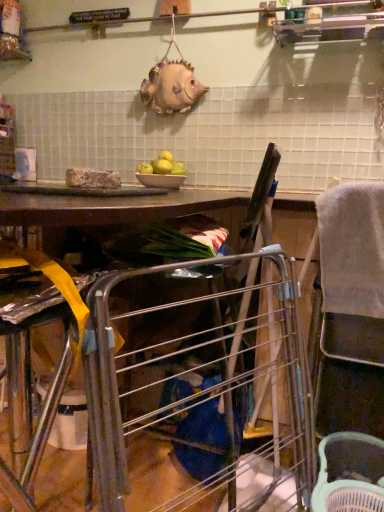
Question: Is white plastic basket at lower right thinner than gray fabric feeding chair at right?

Choices:
 (A) no
 (B) yes

Answer: (A)

Question: Does white plastic basket at lower right have a lesser height compared to gray fabric feeding chair at right?

Choices:
 (A) no
 (B) yes

Answer: (B)

Question: Is white plastic basket at lower right not within gray fabric feeding chair at right?

Choices:
 (A) yes
 (B) no

Answer: (A)

Question: Is white plastic basket at lower right in contact with gray fabric feeding chair at right?

Choices:
 (A) yes
 (B) no

Answer: (B)

Question: Considering the relative sizes of white plastic basket at lower right and gray fabric feeding chair at right in the image provided, is white plastic basket at lower right wider than gray fabric feeding chair at right?

Choices:
 (A) yes
 (B) no

Answer: (A)

Question: Based on their positions, is green matte apples at center located to the left or right of white plastic basket at lower right?

Choices:
 (A) left
 (B) right

Answer: (A)

Question: In terms of size, does green matte apples at center appear bigger or smaller than white plastic basket at lower right?

Choices:
 (A) small
 (B) big

Answer: (A)

Question: From the image's perspective, is green matte apples at center above or below white plastic basket at lower right?

Choices:
 (A) below
 (B) above

Answer: (B)

Question: Choose the correct answer: Is green matte apples at center inside white plastic basket at lower right or outside it?

Choices:
 (A) outside
 (B) inside

Answer: (A)

Question: From a real-world perspective, is gray fabric feeding chair at right positioned above or below white plastic basket at lower right?

Choices:
 (A) above
 (B) below

Answer: (A)

Question: Would you say gray fabric feeding chair at right is to the left or to the right of white plastic basket at lower right in the picture?

Choices:
 (A) right
 (B) left

Answer: (A)

Question: Considering the positions of gray fabric feeding chair at right and white plastic basket at lower right in the image, is gray fabric feeding chair at right wider or thinner than white plastic basket at lower right?

Choices:
 (A) thin
 (B) wide

Answer: (A)

Question: From the image's perspective, is gray fabric feeding chair at right positioned above or below white plastic basket at lower right?

Choices:
 (A) below
 (B) above

Answer: (B)

Question: From a real-world perspective, is white glossy bowl at center physically located above or below white plastic basket at lower right?

Choices:
 (A) below
 (B) above

Answer: (B)

Question: Is white glossy bowl at center spatially inside white plastic basket at lower right, or outside of it?

Choices:
 (A) outside
 (B) inside

Answer: (A)